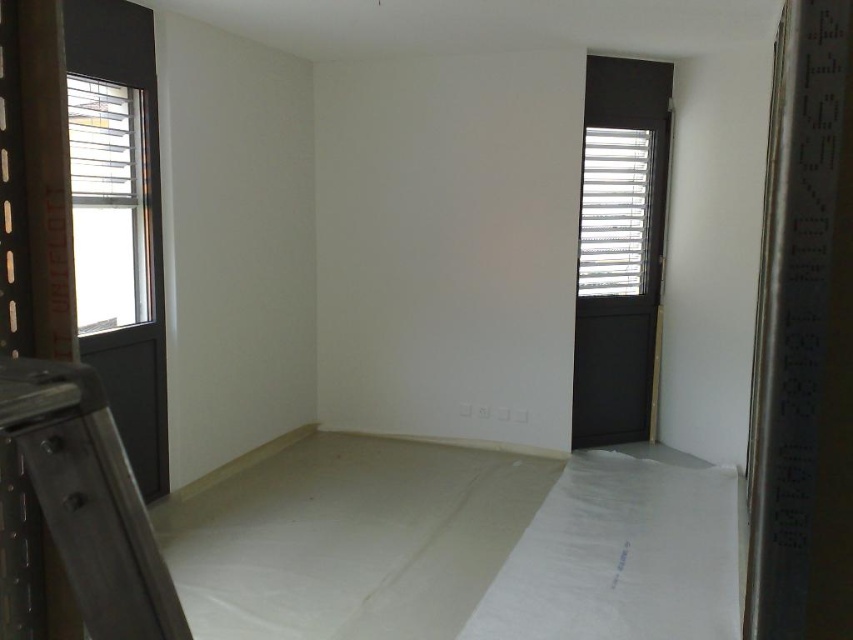
Who is positioned more to the left, metallic black ladder at lower left or white textured blinds at upper right?

metallic black ladder at lower left

Is point (22, 380) behind point (599, 241)?

No, it is in front of (599, 241).

Locate an element on the screen. metallic black ladder at lower left is located at coordinates (90, 499).

Is point (607, 184) positioned after point (91, 237)?

Yes, it is.

Is matte black door at right wider than clear glass window at left?

Yes, matte black door at right is wider than clear glass window at left.

You are a GUI agent. You are given a task and a screenshot of the screen. Output one action in this format:
    pyautogui.click(x=<x>, y=<y>)
    Task: Click on the matte black door at right
    This screenshot has height=640, width=853.
    Given the screenshot: What is the action you would take?
    pyautogui.click(x=618, y=282)

Between clear glass window at left and white textured blinds at upper right, which one is positioned lower?

clear glass window at left is lower down.

Who is higher up, clear glass window at left or white textured blinds at upper right?

white textured blinds at upper right

Where is `clear glass window at left`? clear glass window at left is located at coordinates (109, 204).

Where is `clear glass window at left`? The image size is (853, 640). clear glass window at left is located at coordinates (109, 204).